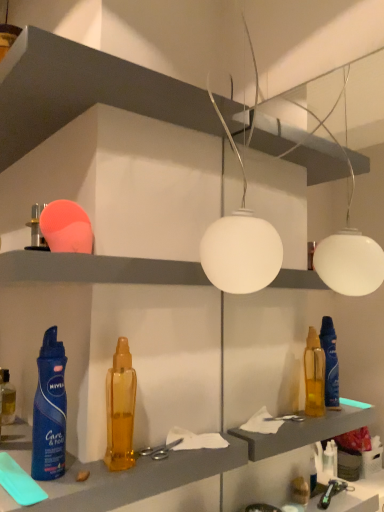
Locate an element on the screen. The height and width of the screenshot is (512, 384). matte plastic shelf at upper center, the 2th shelf positioned from the top is located at coordinates (96, 269).

Measure the distance between matte plastic shelf at upper center, arranged as the first shelf when ordered from the bottom, and camera.

matte plastic shelf at upper center, arranged as the first shelf when ordered from the bottom, and camera are 20.77 inches apart.

What do you see at coordinates (120, 409) in the screenshot? I see `translucent amber bottle at center, the first bottle in the right-to-left sequence` at bounding box center [120, 409].

Measure the distance between point (119,466) and camera.

A distance of 23.74 inches exists between point (119,466) and camera.

Identify the location of white matte shelf at upper center, arranged as the first shelf when viewed from the top. (84, 92).

What do you see at coordinates (159, 449) in the screenshot?
I see `silver metallic scissors at center` at bounding box center [159, 449].

The width and height of the screenshot is (384, 512). In order to click on matte plastic shelf at upper center, arranged as the first shelf when ordered from the bottom in this screenshot , I will do `click(96, 269)`.

Locate an element on the screen. This screenshot has height=512, width=384. tool located on the right of translucent amber bottle at lower left, acting as the first bottle starting from the left is located at coordinates (159, 449).

Is silver metallic scissors at center not close to translucent amber bottle at lower left, acting as the first bottle starting from the left?

No, silver metallic scissors at center is not far away from translucent amber bottle at lower left, acting as the first bottle starting from the left.

From the image's perspective, is silver metallic scissors at center positioned above or below translucent amber bottle at lower left, which is the 1th bottle in back-to-front order?

silver metallic scissors at center is situated lower than translucent amber bottle at lower left, which is the 1th bottle in back-to-front order, in the image.

Is silver metallic scissors at center further to the viewer compared to translucent amber bottle at lower left, which is the 1th bottle in back-to-front order?

No, silver metallic scissors at center is closer to the camera.

Is point (62, 445) closer to camera compared to point (163, 445)?

Yes, point (62, 445) is in front of point (163, 445).

The height and width of the screenshot is (512, 384). What are the coordinates of `the 2nd bottle to the left of the silver metallic scissors at center, counting from the anchor's position` in the screenshot? It's located at (49, 411).

Does blue matte spray can at lower left, which is the 1th bottle from front to back, come in front of silver metallic scissors at center?

Yes, the depth of blue matte spray can at lower left, which is the 1th bottle from front to back, is less than that of silver metallic scissors at center.

Between blue matte spray can at lower left, the second bottle from the right, and silver metallic scissors at center, which one has larger size?

Bigger between the two is blue matte spray can at lower left, the second bottle from the right.

Does white matte shelf at upper center, the 2th shelf from the bottom, lie in front of translucent amber bottle at lower left, acting as the first bottle starting from the left?

That is True.

Which is nearer, (123, 65) or (3, 392)?

Point (123, 65).

Can you tell me how much white matte shelf at upper center, the 2th shelf from the bottom, and translucent amber bottle at lower left, the 3th bottle viewed from the front, differ in facing direction?

They differ by 0.00152 degrees in their facing directions.

From the picture: Could you tell me if white matte shelf at upper center, the 2th shelf from the bottom, is turned towards translucent amber bottle at lower left, which is counted as the 3th bottle, starting from the right?

No, white matte shelf at upper center, the 2th shelf from the bottom, is not facing towards translucent amber bottle at lower left, which is counted as the 3th bottle, starting from the right.

How different are the orientations of white matte shelf at upper center, the 2th shelf from the bottom, and blue matte spray can at lower left, which is the 1th bottle from front to back, in degrees?

There is a 0.00154-degree angle between the facing directions of white matte shelf at upper center, the 2th shelf from the bottom, and blue matte spray can at lower left, which is the 1th bottle from front to back.

Consider the image. Is white matte shelf at upper center, the 2th shelf from the bottom, to the left of blue matte spray can at lower left, placed as the 2th bottle when sorted from left to right, from the viewer's perspective?

Yes, white matte shelf at upper center, the 2th shelf from the bottom, is to the left of blue matte spray can at lower left, placed as the 2th bottle when sorted from left to right.

Which object is wider, white matte shelf at upper center, arranged as the first shelf when viewed from the top, or blue matte spray can at lower left, placed as the 2th bottle when sorted from left to right?

With larger width is white matte shelf at upper center, arranged as the first shelf when viewed from the top.

Is white matte shelf at upper center, arranged as the first shelf when viewed from the top, behind blue matte spray can at lower left, the second bottle from the right?

No, white matte shelf at upper center, arranged as the first shelf when viewed from the top, is in front of blue matte spray can at lower left, the second bottle from the right.

From a real-world perspective, relative to blue matte spray can at lower left, which is the 1th bottle from front to back, is translucent plastic bottle at center vertically above or below?

translucent plastic bottle at center is below blue matte spray can at lower left, which is the 1th bottle from front to back.

From the picture: Which is correct: translucent plastic bottle at center is inside blue matte spray can at lower left, the second bottle from the right, or outside of it?

translucent plastic bottle at center cannot be found inside blue matte spray can at lower left, the second bottle from the right.

Is translucent plastic bottle at center not near blue matte spray can at lower left, placed as the 3th bottle when sorted from back to front?

No, there isn't a large distance between translucent plastic bottle at center and blue matte spray can at lower left, placed as the 3th bottle when sorted from back to front.

Where is `cabinet located on the left of blue matte spray can at lower left, placed as the 2th bottle when sorted from left to right`? The height and width of the screenshot is (512, 384). cabinet located on the left of blue matte spray can at lower left, placed as the 2th bottle when sorted from left to right is located at coordinates (133, 480).

Looking at this image, from the image's perspective, is white matte globe at center located beneath white matte shelf at upper center, the 2th shelf from the bottom?

Correct, white matte globe at center appears lower than white matte shelf at upper center, the 2th shelf from the bottom, in the image.

From a real-world perspective, is white matte globe at center on white matte shelf at upper center, arranged as the first shelf when viewed from the top?

No.

Is white matte globe at center completely or partially outside of white matte shelf at upper center, arranged as the first shelf when viewed from the top?

Yes, white matte globe at center is located beyond the bounds of white matte shelf at upper center, arranged as the first shelf when viewed from the top.

Considering the positions of objects white matte globe at center and white matte shelf at upper center, the 2th shelf from the bottom, in the image provided, who is more to the left, white matte globe at center or white matte shelf at upper center, the 2th shelf from the bottom,?

Positioned to the left is white matte shelf at upper center, the 2th shelf from the bottom.

Is silver metallic scissors at center located within white matte shelf at upper center, arranged as the first shelf when viewed from the top?

No, silver metallic scissors at center is located outside of white matte shelf at upper center, arranged as the first shelf when viewed from the top.

From the image's perspective, would you say white matte shelf at upper center, arranged as the first shelf when viewed from the top, is positioned over silver metallic scissors at center?

Indeed, from the image's perspective, white matte shelf at upper center, arranged as the first shelf when viewed from the top, is shown above silver metallic scissors at center.

I want to click on shelf that is the 2nd object located above the silver metallic scissors at center (from the image's perspective), so click(x=84, y=92).

Are white matte shelf at upper center, arranged as the first shelf when viewed from the top, and silver metallic scissors at center far apart?

That's not correct — white matte shelf at upper center, arranged as the first shelf when viewed from the top, is a little close to silver metallic scissors at center.

The height and width of the screenshot is (512, 384). I want to click on bottle located behind the silver metallic scissors at center, so click(7, 397).

Identify the location of tool that appears on the right of blue matte spray can at lower left, the second bottle from the right. (159, 449).

Based on the photo, when comparing their distances from silver metallic scissors at center, does translucent amber bottle at center, which is the third bottle in left-to-right order, or white matte shelf at upper center, the 2th shelf from the bottom, seem closer?

Among the two, translucent amber bottle at center, which is the third bottle in left-to-right order, is located nearer to silver metallic scissors at center.

From the image, which object appears to be nearer to translucent plastic bottle at center, translucent amber bottle at center, which is the third bottle in left-to-right order, or translucent amber bottle at lower left, which is counted as the 3th bottle, starting from the right?

translucent amber bottle at center, which is the third bottle in left-to-right order, is closer to translucent plastic bottle at center.

Looking at the image, which one is located closer to matte plastic shelf at upper center, the 2th shelf positioned from the top, translucent amber bottle at lower left, which is counted as the 3th bottle, starting from the right, or translucent plastic bottle at center?

Based on the image, translucent plastic bottle at center appears to be nearer to matte plastic shelf at upper center, the 2th shelf positioned from the top.

From the image, which object appears to be farther from silver metallic scissors at center, white matte shelf at upper center, the 2th shelf from the bottom, or translucent plastic bottle at center?

The object further to silver metallic scissors at center is white matte shelf at upper center, the 2th shelf from the bottom.

Consider the image. Looking at the image, which one is located closer to matte plastic shelf at upper center, the 2th shelf positioned from the top, white matte globe at center or translucent amber bottle at lower left, acting as the first bottle starting from the left?

white matte globe at center is positioned closer to the anchor matte plastic shelf at upper center, the 2th shelf positioned from the top.

From the image, which object appears to be farther from blue matte spray can at lower left, placed as the 3th bottle when sorted from back to front, white matte shelf at upper center, arranged as the first shelf when viewed from the top, or translucent amber bottle at lower left, the 3th bottle viewed from the front?

white matte shelf at upper center, arranged as the first shelf when viewed from the top, is positioned further to the anchor blue matte spray can at lower left, placed as the 3th bottle when sorted from back to front.

From the image, which object appears to be farther from silver metallic scissors at center, blue matte spray can at lower left, the second bottle from the right, or translucent amber bottle at lower left, which is the 1th bottle in back-to-front order?

translucent amber bottle at lower left, which is the 1th bottle in back-to-front order.

Estimate the real-world distances between objects in this image. Which object is further from translucent amber bottle at center, the first bottle in the right-to-left sequence, white matte globe at center or translucent amber bottle at lower left, acting as the first bottle starting from the left?

white matte globe at center is positioned further to the anchor translucent amber bottle at center, the first bottle in the right-to-left sequence.

I want to click on cabinet between translucent amber bottle at lower left, which is the 1th bottle in back-to-front order, and silver metallic scissors at center, in the horizontal direction, so click(133, 480).

You are a GUI agent. You are given a task and a screenshot of the screen. Output one action in this format:
    pyautogui.click(x=<x>, y=<y>)
    Task: Click on the bottle that lies between white matte shelf at upper center, the 2th shelf from the bottom, and translucent amber bottle at center, the 2th bottle when ordered from back to front, from top to bottom
    This screenshot has height=512, width=384.
    Given the screenshot: What is the action you would take?
    pyautogui.click(x=49, y=411)

This screenshot has width=384, height=512. In order to click on shelf that lies between white matte globe at center and silver metallic scissors at center from top to bottom in this screenshot , I will do `click(96, 269)`.

I want to click on tool between white matte shelf at upper center, the 2th shelf from the bottom, and translucent plastic bottle at center vertically, so click(x=159, y=449).